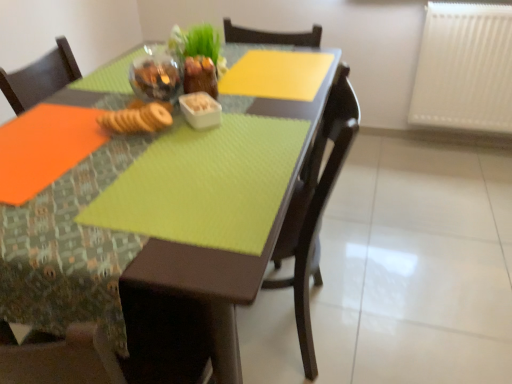
Question: From the image's perspective, is matte brown chair at center located above or below translucent glass bowl at upper center, acting as the 1th tableware starting from the left?

Choices:
 (A) below
 (B) above

Answer: (A)

Question: Is matte brown chair at center taller or shorter than translucent glass bowl at upper center, the second tableware viewed from the right?

Choices:
 (A) short
 (B) tall

Answer: (B)

Question: Estimate the real-world distances between objects in this image. Which object is farther from the brown crumbly biscuit at center?

Choices:
 (A) white plastic radiator at upper right
 (B) white plastic container at center, the 1th tableware when ordered from right to left
 (C) translucent glass bowl at upper center, the second tableware viewed from the right
 (D) matte brown chair at center

Answer: (A)

Question: Considering the real-world distances, which object is closest to the white plastic container at center, which is counted as the 2th tableware, starting from the left?

Choices:
 (A) white plastic radiator at upper right
 (B) matte brown chair at center
 (C) translucent glass bowl at upper center, the second tableware viewed from the right
 (D) brown crumbly biscuit at center

Answer: (D)